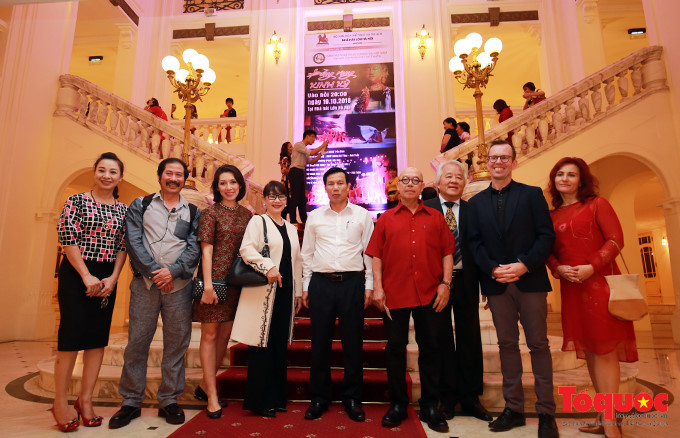
Where is `stairs`? The height and width of the screenshot is (438, 680). stairs is located at coordinates (296, 377).